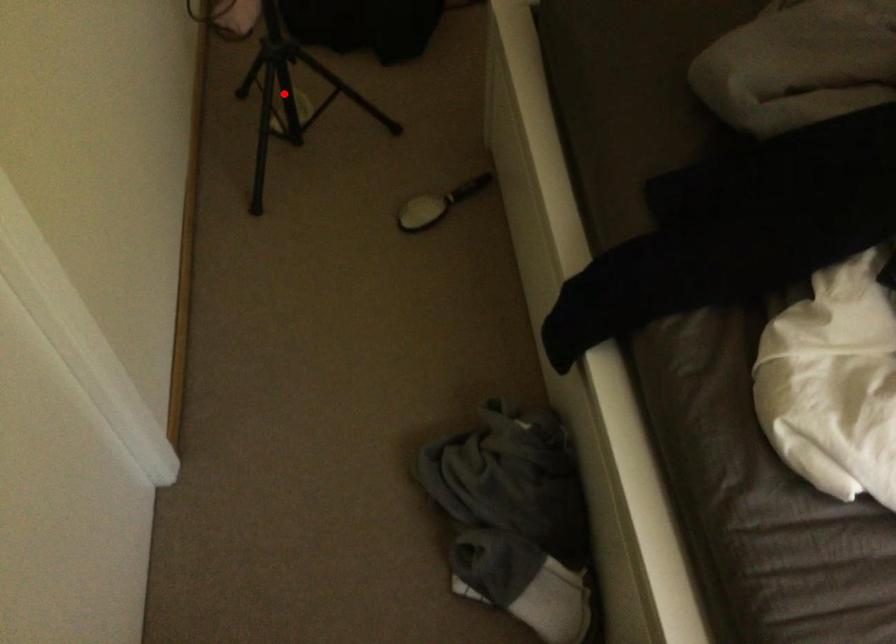
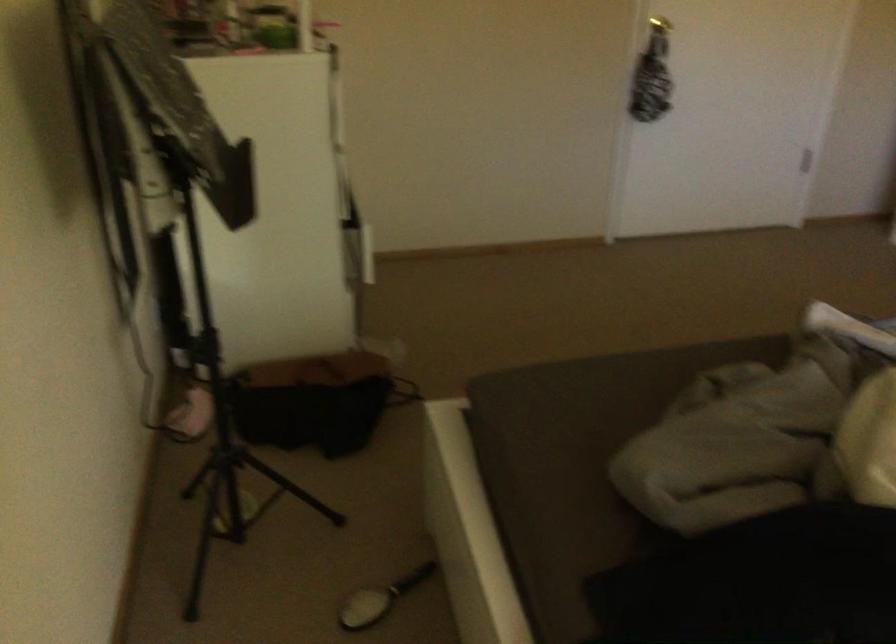
Question: I am providing you with two images of the same scene from different viewpoints. A red point is marked on the first image. Can you still see the location of the red point in image 2?

Choices:
 (A) Yes
 (B) No

Answer: (B)